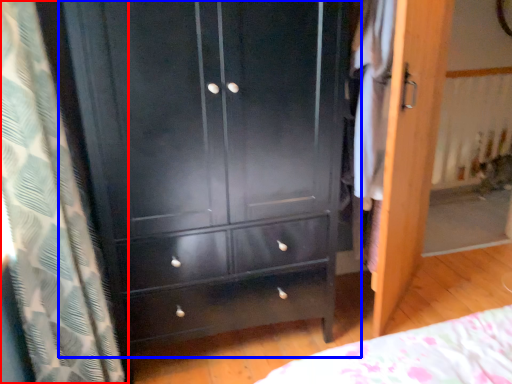
Question: Which point is closer to the camera, curtain (highlighted by a red box) or chest of drawers (highlighted by a blue box)?

Choices:
 (A) curtain
 (B) chest of drawers

Answer: (A)